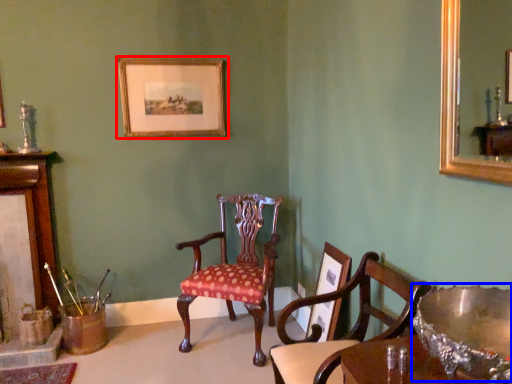
Question: Among these objects, which one is farthest to the camera, picture frame (highlighted by a red box) or glass bowl (highlighted by a blue box)?

Choices:
 (A) picture frame
 (B) glass bowl

Answer: (A)